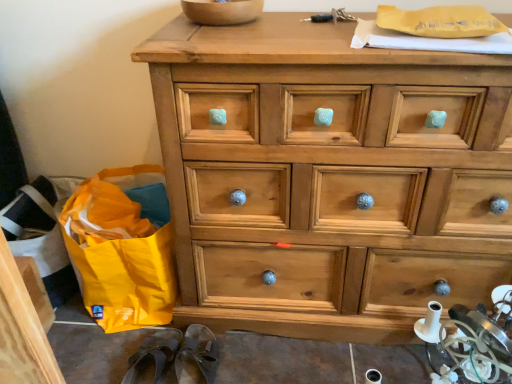
Find the location of a particular element. This screenshot has height=384, width=512. vacant point to the right of wooden bowl at upper center is located at coordinates (294, 18).